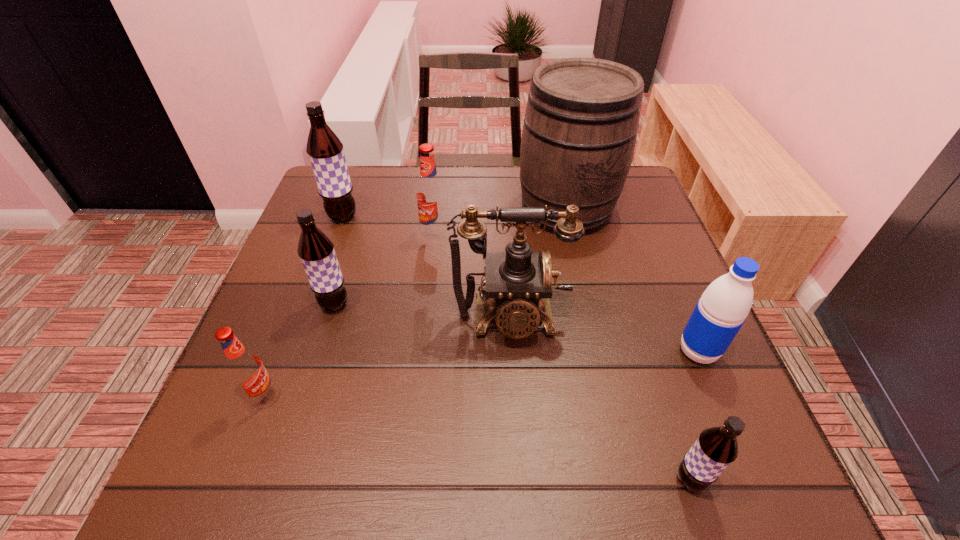
I want to click on the fourth farthest root beer, so click(x=245, y=368).

Image resolution: width=960 pixels, height=540 pixels. I want to click on the left red root beer, so click(245, 368).

I want to click on the nearest object, so click(x=716, y=448).

Find the location of `the nearest root beer`. the nearest root beer is located at coordinates (716, 448).

The width and height of the screenshot is (960, 540). Find the location of `vacant space situated on the front of the wine bucket`. vacant space situated on the front of the wine bucket is located at coordinates (590, 313).

You are a GUI agent. You are given a task and a screenshot of the screen. Output one action in this format:
    pyautogui.click(x=<x>, y=<y>)
    Task: Click on the free location located on the back of the farthest brown root beer
    Image resolution: width=960 pixels, height=540 pixels.
    Given the screenshot: What is the action you would take?
    pyautogui.click(x=351, y=192)

This screenshot has height=540, width=960. What are the coordinates of `vacant space situated on the rotary dial of the telephone` in the screenshot? It's located at (514, 377).

Find the location of `vacant area situated on the left of the second root beer from right to left`. vacant area situated on the left of the second root beer from right to left is located at coordinates (309, 234).

The image size is (960, 540). Find the location of `vacant space located on the right of the second smallest brown root beer`. vacant space located on the right of the second smallest brown root beer is located at coordinates (378, 304).

Where is `free space located 0.130m on the left of the rightmost object`? This screenshot has width=960, height=540. free space located 0.130m on the left of the rightmost object is located at coordinates (611, 352).